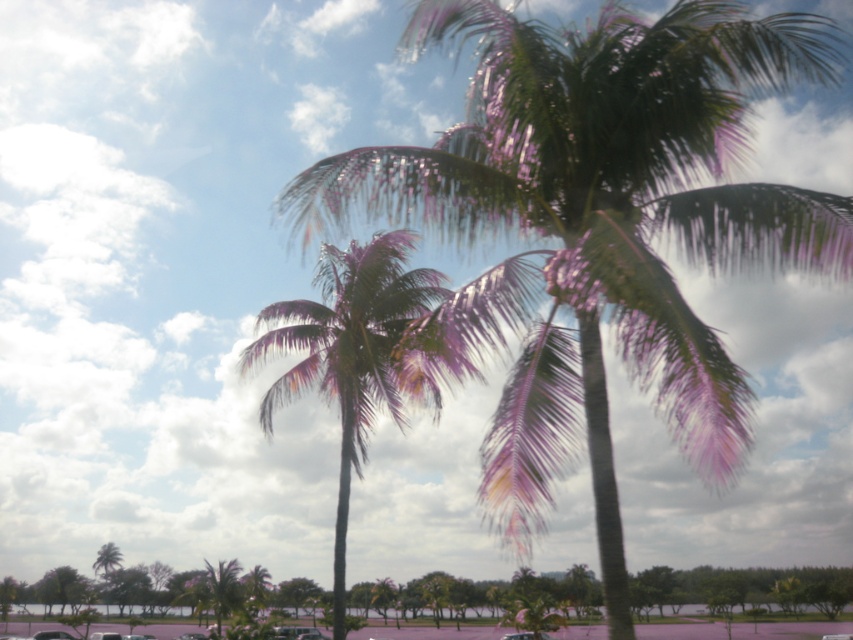
You are standing in the middle of an open field and see both the green leafy coconut tree at center and the green leafy palm tree at center. Which tree is blocking your view of the other?

The green leafy coconut tree at center is positioned over the green leafy palm tree at center, so it is blocking the view of the palm tree.

You are standing in the middle of the open area and want to place a picnic blanket between the green leafy coconut tree at center and the green leafy palm tree at center. If the blanket is 5 meters long, will it fit between them?

The green leafy coconut tree at center is 4.91 meters away from the green leafy palm tree at center, so the 5 meter long blanket will fit between them with a small amount of space remaining.

You are standing in the vibrant outdoor scene with tall palm trees. There is a green leafy coconut tree at center and a point marked at coordinate (599, 224). Can you determine if the point is located on the green leafy coconut tree at center?

The point (599, 224) represents the green leafy coconut tree at center, so yes, the point is located on the green leafy coconut tree at center.